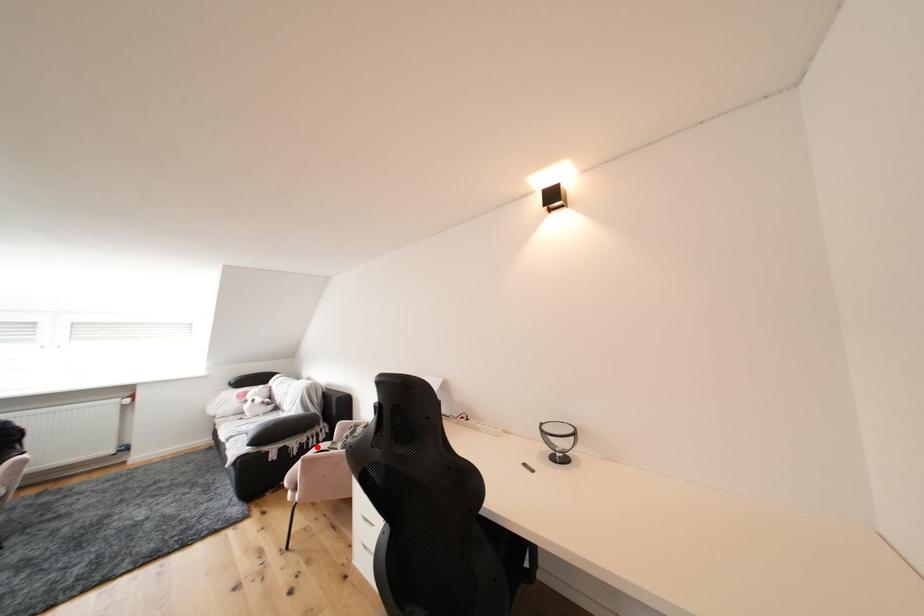
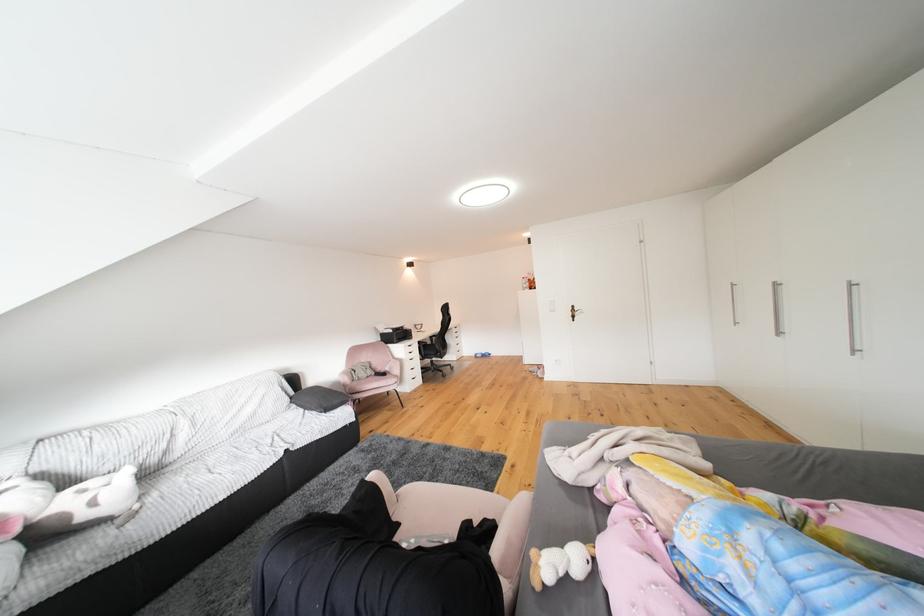
Question: I am providing you with two images of the same scene from different viewpoints. A red point is marked on the first image. Is the red point's position out of view in image 2?

Choices:
 (A) Yes
 (B) No

Answer: (A)